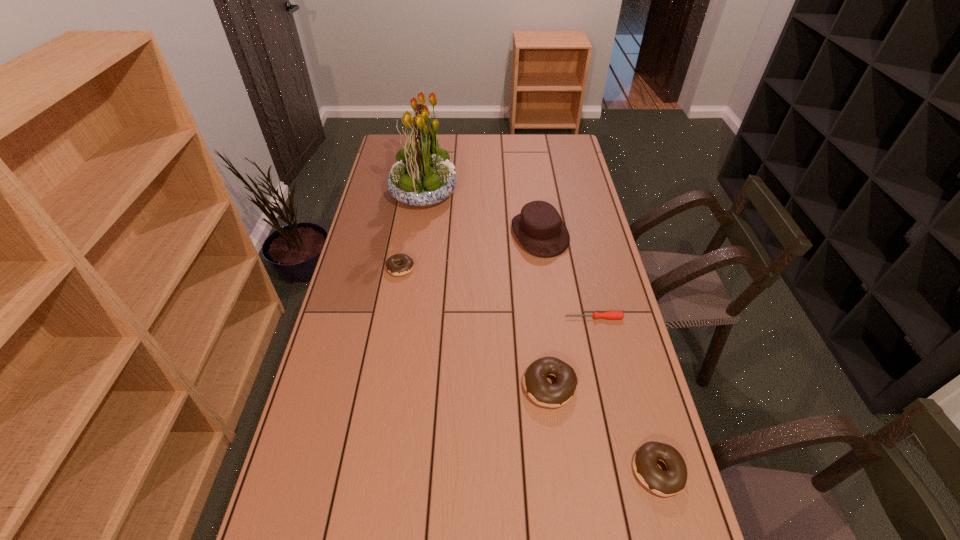
You are a GUI agent. You are given a task and a screenshot of the screen. Output one action in this format:
    pyautogui.click(x=<x>, y=<y>)
    Task: Click on the vacant position in the image that satisfies the following two spatial constraints: 1. on the front-facing side of the tallest object; 2. on the front side of the leftmost doughnut
    The image size is (960, 540).
    Given the screenshot: What is the action you would take?
    pyautogui.click(x=412, y=268)

Where is `blank area in the image that satisfies the following two spatial constraints: 1. on the front-facing side of the tallest object; 2. on the front side of the leftmost doughnut`? Image resolution: width=960 pixels, height=540 pixels. blank area in the image that satisfies the following two spatial constraints: 1. on the front-facing side of the tallest object; 2. on the front side of the leftmost doughnut is located at coordinates (412, 268).

Identify the location of blank space that satisfies the following two spatial constraints: 1. at the tip of the nearest doughnut; 2. on the left side of the screwdriver. [629, 471].

The width and height of the screenshot is (960, 540). I want to click on free space that satisfies the following two spatial constraints: 1. at the tip of the third shortest object; 2. on the left side of the third nearest object, so (629, 471).